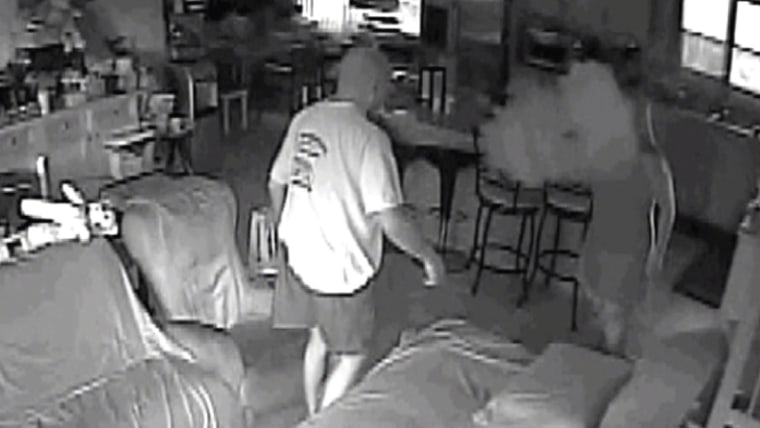
Image resolution: width=760 pixels, height=428 pixels. What are the coordinates of `stuffed toy` in the screenshot? It's located at (73, 228).